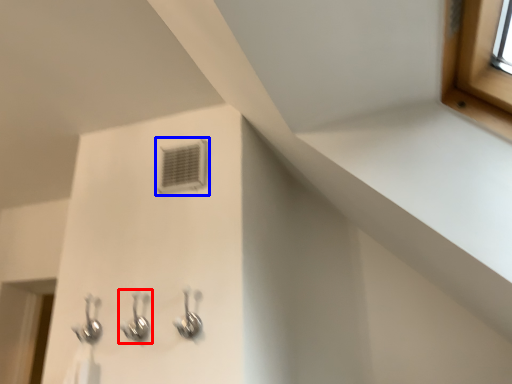
Question: Which of the following is the farthest to the observer, plumbing fixture (highlighted by a red box) or air conditioning (highlighted by a blue box)?

Choices:
 (A) plumbing fixture
 (B) air conditioning

Answer: (B)